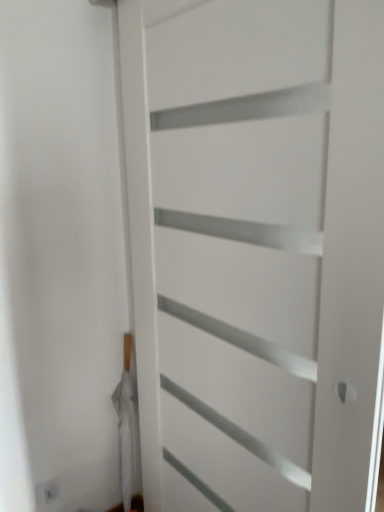
Identify the location of white plastic electric outlet at lower left. The width and height of the screenshot is (384, 512). (47, 490).

Image resolution: width=384 pixels, height=512 pixels. Describe the element at coordinates (47, 490) in the screenshot. I see `white plastic electric outlet at lower left` at that location.

Locate an element on the screen. The width and height of the screenshot is (384, 512). white plastic electric outlet at lower left is located at coordinates (47, 490).